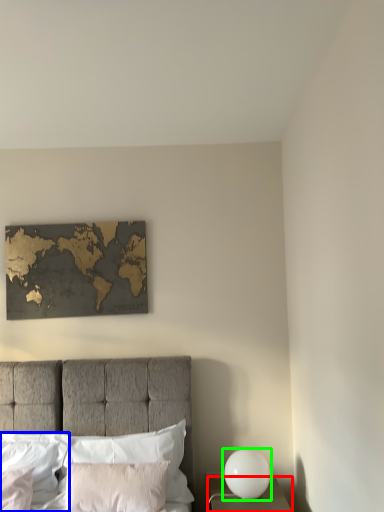
Question: Based on their relative distances, which object is farther from nightstand (highlighted by a red box)? Choose from pillow (highlighted by a blue box) and bedside lamp (highlighted by a green box).

Choices:
 (A) pillow
 (B) bedside lamp

Answer: (A)